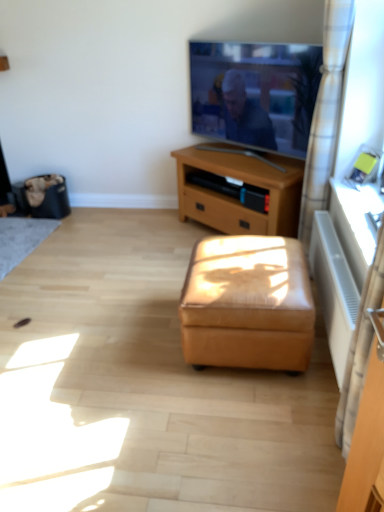
At what (x,y) coordinates should I click in order to perform the action: click on vacant space to the right of black fabric trash bin at left. Please return your answer as a coordinate pair (x, y). This screenshot has height=512, width=384. Looking at the image, I should click on (96, 213).